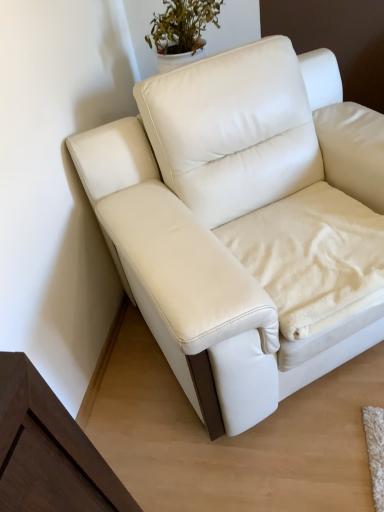
Measure the distance between white fleece blanket at lower right and camera.

white fleece blanket at lower right is 1.07 meters from camera.

The image size is (384, 512). Describe the element at coordinates (310, 252) in the screenshot. I see `white fleece blanket at lower right` at that location.

Measure the distance between point (375,246) and camera.

Point (375,246) is 1.22 meters away from camera.

Locate an element on the screen. The width and height of the screenshot is (384, 512). white fleece blanket at lower right is located at coordinates (310, 252).

In order to face white leather couch at center, should I rotate leftwards or rightwards?

Rotate right and turn 11.632 degrees.

The image size is (384, 512). I want to click on white leather couch at center, so click(x=244, y=221).

What do you see at coordinates (244, 221) in the screenshot? The height and width of the screenshot is (512, 384). I see `white leather couch at center` at bounding box center [244, 221].

Locate an element on the screen. The image size is (384, 512). white fleece blanket at lower right is located at coordinates (310, 252).

Based on their positions, is white leather couch at center located to the left or right of white fleece blanket at lower right?

From the image, it's evident that white leather couch at center is to the left of white fleece blanket at lower right.

Is white leather couch at center behind white fleece blanket at lower right?

No, white leather couch at center is closer to the viewer.

Is point (132, 186) closer to viewer compared to point (289, 265)?

No, (132, 186) is further to viewer.

In the scene shown: From the image's perspective, is white leather couch at center beneath white fleece blanket at lower right?

No, from the image's perspective, white leather couch at center is not below white fleece blanket at lower right.

Consider the image. From a real-world perspective, is white leather couch at center physically below white fleece blanket at lower right?

No.

Considering the sizes of objects white leather couch at center and white fleece blanket at lower right in the image provided, who is thinner, white leather couch at center or white fleece blanket at lower right?

With smaller width is white fleece blanket at lower right.

Is white leather couch at center shorter than white fleece blanket at lower right?

No, white leather couch at center is not shorter than white fleece blanket at lower right.

Who is bigger, white leather couch at center or white fleece blanket at lower right?

With larger size is white leather couch at center.

Is white leather couch at center spatially inside white fleece blanket at lower right, or outside of it?

white leather couch at center lies outside white fleece blanket at lower right.

Consider the image. Can you see white leather couch at center touching white fleece blanket at lower right?

white leather couch at center and white fleece blanket at lower right are clearly separated.

Could you tell me if white leather couch at center is facing white fleece blanket at lower right?

Yes, white leather couch at center is aimed at white fleece blanket at lower right.

In order to click on sheet located on the right of white leather couch at center in this screenshot , I will do `click(310, 252)`.

Visually, is white fleece blanket at lower right positioned to the left or to the right of white leather couch at center?

white fleece blanket at lower right is positioned on white leather couch at center's right side.

Relative to white leather couch at center, is white fleece blanket at lower right in front or behind?

Clearly, white fleece blanket at lower right is behind white leather couch at center.

Which point is more forward, (x=227, y=242) or (x=337, y=137)?

Positioned in front is point (x=227, y=242).

From the image's perspective, does white fleece blanket at lower right appear lower than white leather couch at center?

Correct, white fleece blanket at lower right appears lower than white leather couch at center in the image.

From a real-world perspective, is white fleece blanket at lower right positioned above or below white leather couch at center?

Clearly, from a real-world perspective, white fleece blanket at lower right is below white leather couch at center.

Considering the sizes of white fleece blanket at lower right and white leather couch at center in the image, is white fleece blanket at lower right wider or thinner than white leather couch at center?

white fleece blanket at lower right is thinner than white leather couch at center.

Is white fleece blanket at lower right taller than white leather couch at center?

Incorrect, the height of white fleece blanket at lower right is not larger of that of white leather couch at center.

Does white fleece blanket at lower right have a larger size compared to white leather couch at center?

Actually, white fleece blanket at lower right might be smaller than white leather couch at center.

In the scene shown: Is white fleece blanket at lower right outside of white leather couch at center?

That's incorrect, white fleece blanket at lower right is not completely outside white leather couch at center.

From the picture: Is white fleece blanket at lower right not near white leather couch at center?

A: That's not correct — white fleece blanket at lower right is a little close to white leather couch at center.

Does white fleece blanket at lower right turn towards white leather couch at center?

Yes, white fleece blanket at lower right is facing white leather couch at center.

The width and height of the screenshot is (384, 512). Find the location of `sheet below the white leather couch at center (from a real-world perspective)`. sheet below the white leather couch at center (from a real-world perspective) is located at coordinates (310, 252).

Find the location of a particular element. This screenshot has height=512, width=384. studio couch that is above the white fleece blanket at lower right (from the image's perspective) is located at coordinates (244, 221).

Identify the location of sheet to the right of white leather couch at center. (310, 252).